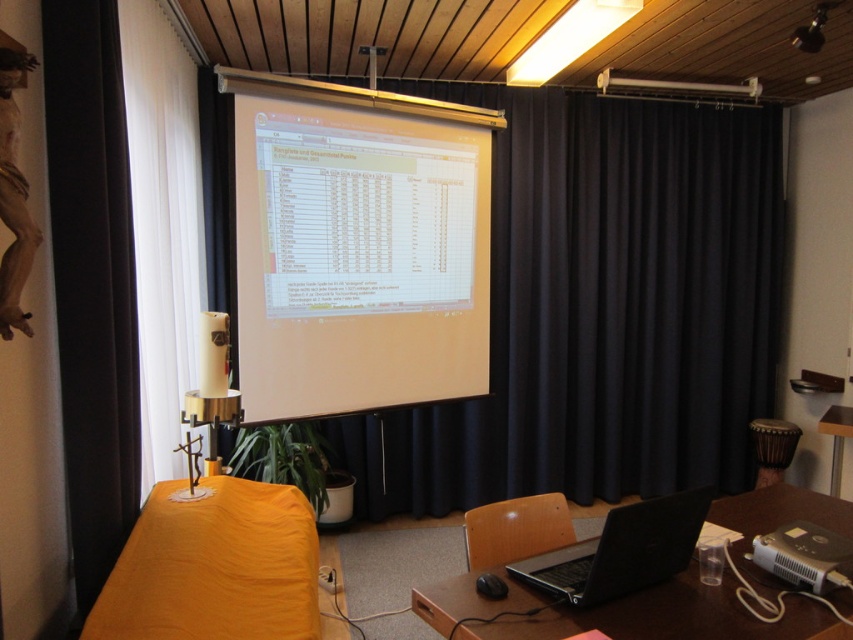
Question: Which object appears farthest from the camera in this image?

Choices:
 (A) silver metallic projector at lower right
 (B) wooden table at center
 (C) white matte projection screen at center

Answer: (B)

Question: Which point is farther from the camera taking this photo?

Choices:
 (A) (399, 390)
 (B) (183, 374)
 (C) (555, 540)

Answer: (A)

Question: Can you confirm if brown wooden table at lower right is positioned to the left of silver metallic projector at lower right?

Choices:
 (A) yes
 (B) no

Answer: (A)

Question: Among these objects, which one is farthest from the camera?

Choices:
 (A) brown wooden table at lower right
 (B) black matte laptop at lower right
 (C) black fabric curtain at upper center
 (D) white matte speaker at upper center

Answer: (C)

Question: Can you confirm if black fabric curtain at upper center is thinner than white matte projection screen at center?

Choices:
 (A) yes
 (B) no

Answer: (B)

Question: Observing the image, what is the correct spatial positioning of white matte projection screen at center in reference to wooden table at center?

Choices:
 (A) below
 (B) above

Answer: (B)